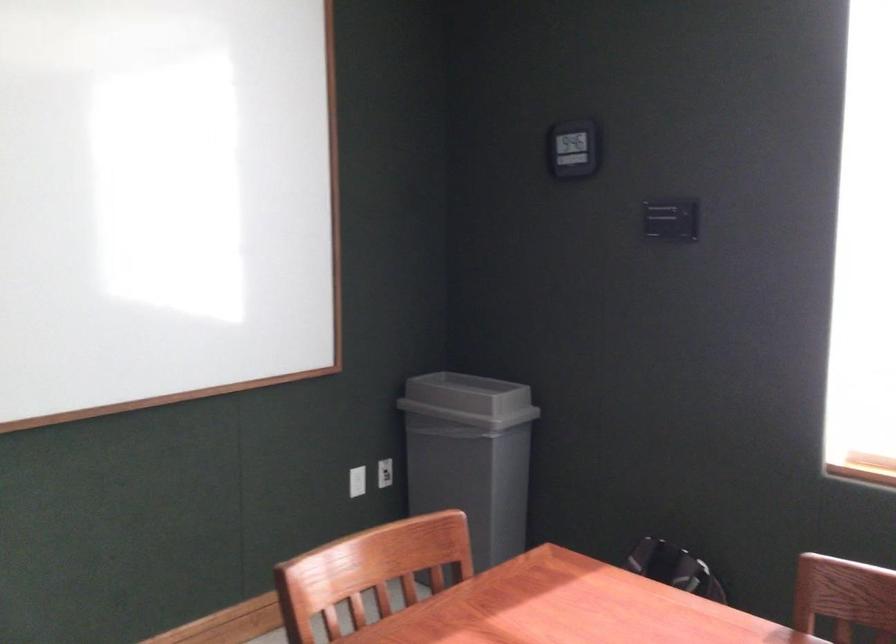
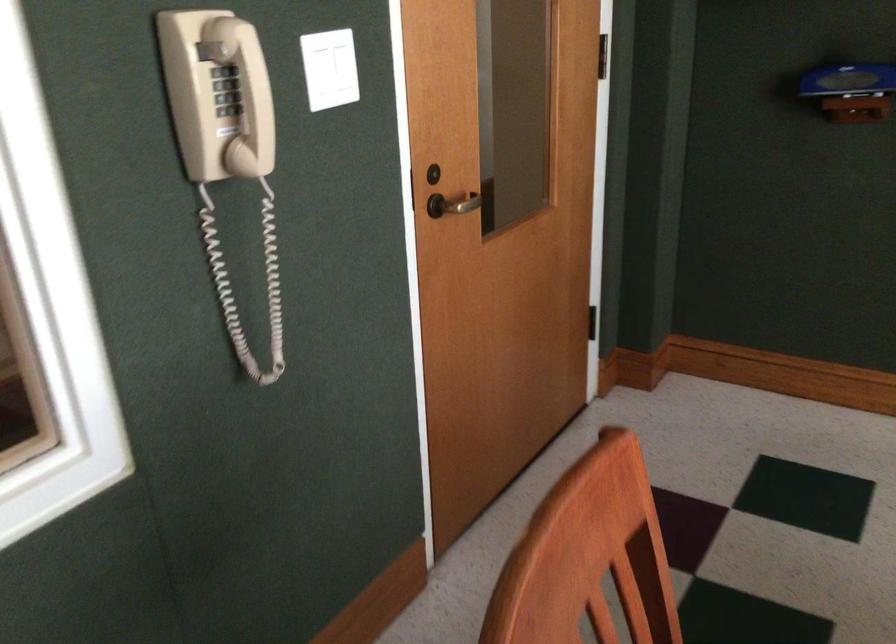
The images are taken continuously from a first-person perspective. In which direction is your viewpoint rotating?

The camera's rotation is toward left-down.